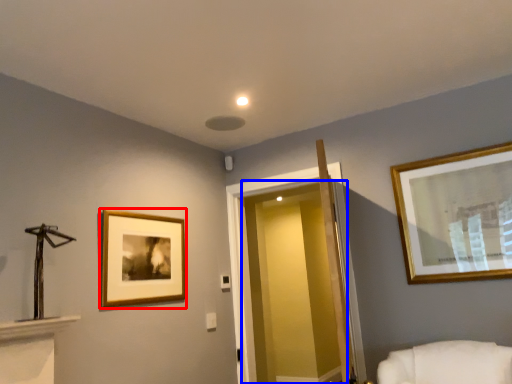
Question: Which object is further to the camera taking this photo, picture frame (highlighted by a red box) or glass door (highlighted by a blue box)?

Choices:
 (A) picture frame
 (B) glass door

Answer: (B)